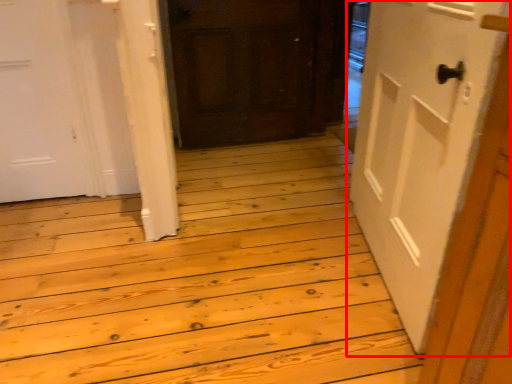
Question: From the image's perspective, considering the relative positions of door (annotated by the red box) and door in the image provided, where is door (annotated by the red box) located with respect to the staircase?

Choices:
 (A) below
 (B) above

Answer: (A)